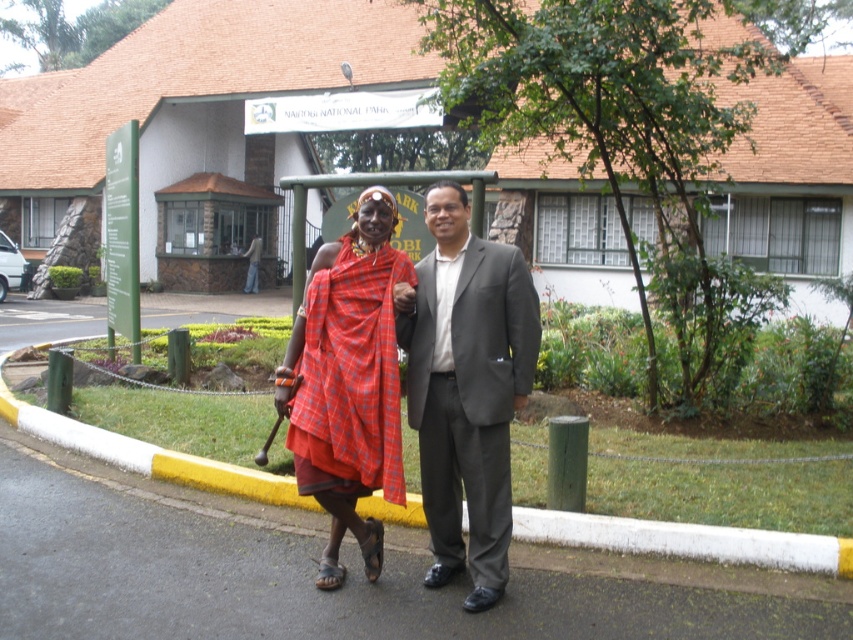
You are a photographer standing at the entrance of Nairobi National Park. You want to take a photo that includes both the person in Maasai attire and the banner above the entrance. The two points you need to focus on are point (432,372) and point (228,472). Which point should you focus on first to ensure both subjects are in focus?

You should focus on point (432,372) first because it is closer to the camera than point (228,472), ensuring both subjects are within the depth of field.

You are a photographer trying to capture both the matte gray suit at center and the red plaid cloth at center in a single frame. Based on their positions, which object should you focus on first to ensure both are in the shot?

The red plaid cloth at center should be focused on first since the matte gray suit at center is to the right of it. By centering the red plaid cloth, you can adjust the camera to include the matte gray suit at center to its right in the frame.

You are a photographer trying to capture both the matte gray suit at center and the yellow rubber curb at lower center in a single frame. Based on their sizes, which object should you focus on first to ensure both fit in the shot?

The matte gray suit at center is wider than the yellow rubber curb at lower center, so you should focus on the matte gray suit at center first to ensure both fit in the shot.